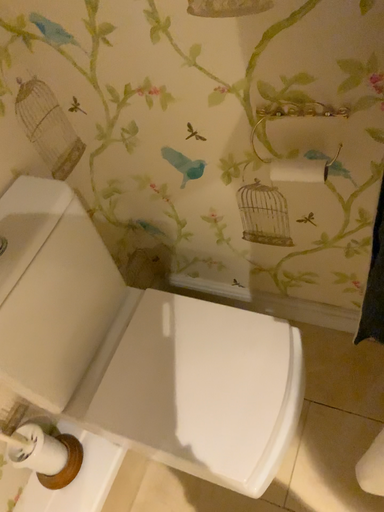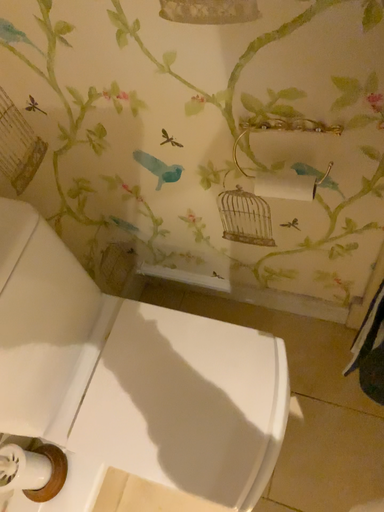
Question: How did the camera likely rotate when shooting the video?

Choices:
 (A) rotated downward
 (B) rotated upward

Answer: (A)